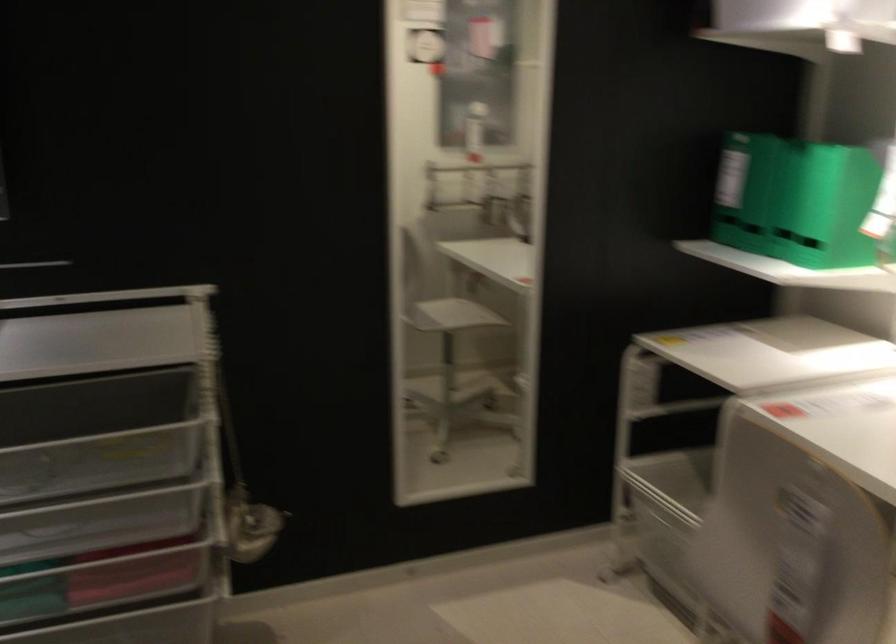
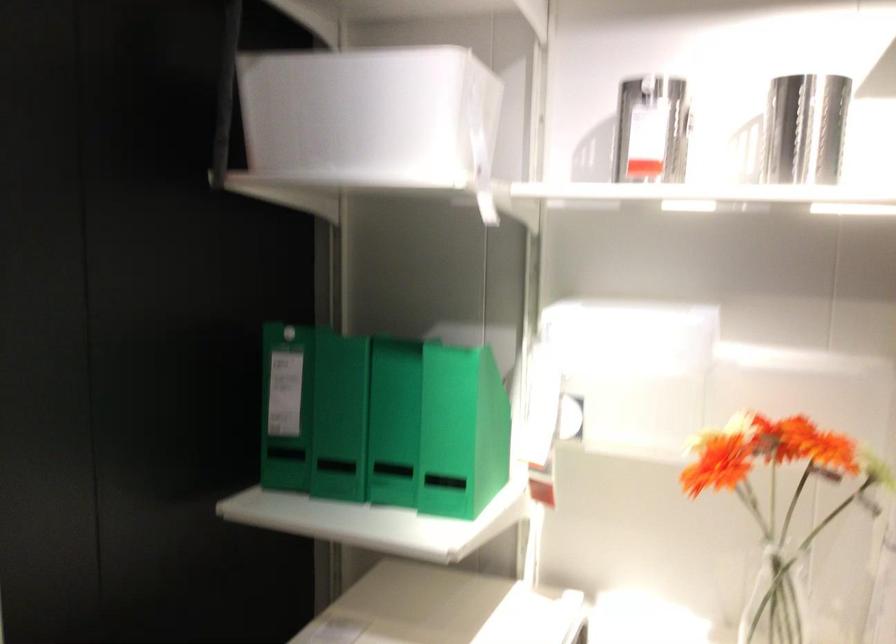
The point at [717,185] is marked in the first image. Where is the corresponding point in the second image?

(286, 406)